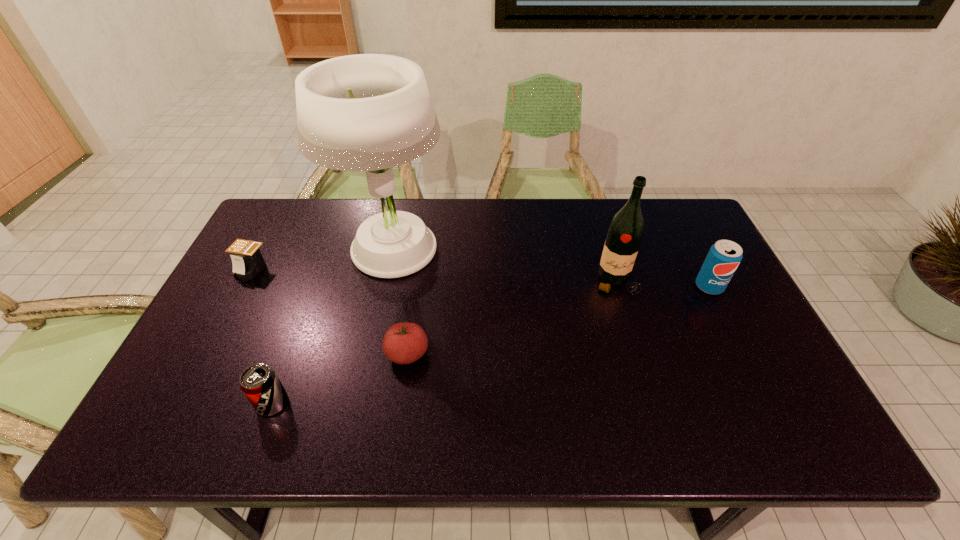
At what (x,y) coordinates should I click in order to perform the action: click on free space at the far edge of the desktop. Please return your answer as a coordinate pair (x, y). The height and width of the screenshot is (540, 960). Looking at the image, I should click on (519, 222).

In the image, there is a desktop. At what (x,y) coordinates should I click in order to perform the action: click on blank space at the near edge. Please return your answer as a coordinate pair (x, y). This screenshot has height=540, width=960. Looking at the image, I should click on (317, 432).

Where is `vacant space at the left edge of the desktop`? The height and width of the screenshot is (540, 960). vacant space at the left edge of the desktop is located at coordinates (210, 407).

Identify the location of vacant space at the right edge of the desktop. This screenshot has height=540, width=960. (700, 305).

Image resolution: width=960 pixels, height=540 pixels. I want to click on free location at the near left corner of the desktop, so click(x=207, y=431).

Find the location of a particular element. This screenshot has height=540, width=960. vacant position at the far right corner of the desktop is located at coordinates (684, 199).

Locate an element on the screen. The height and width of the screenshot is (540, 960). blank region between the nearest object and the tomato is located at coordinates (340, 378).

I want to click on vacant area between the fourth shortest object and the left soda can, so click(491, 345).

Locate an element on the screen. Image resolution: width=960 pixels, height=540 pixels. vacant area that lies between the fifth object from left to right and the tomato is located at coordinates (512, 318).

Find the location of a particular element. Image resolution: width=960 pixels, height=540 pixels. free space between the calculator and the second object from right to left is located at coordinates (434, 275).